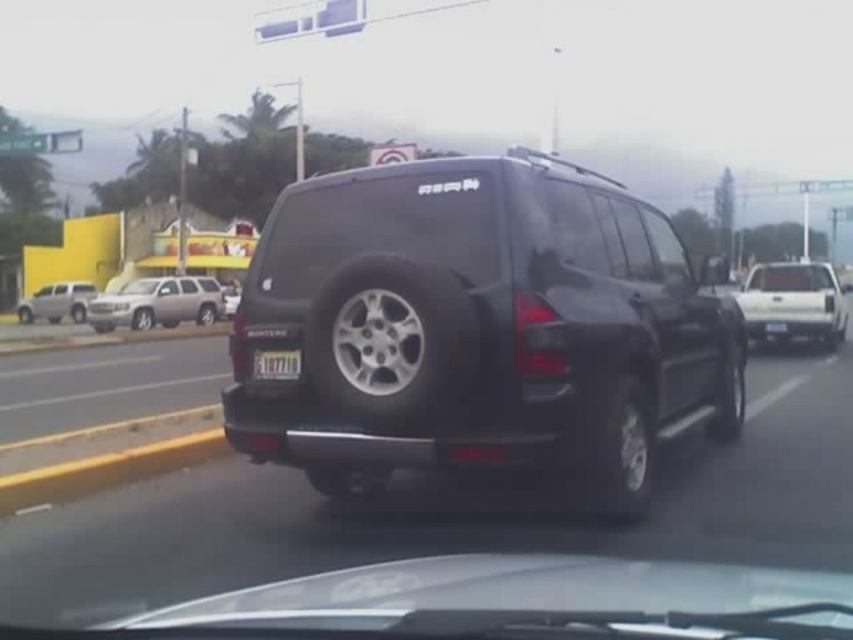
Question: Which point is farther to the camera?

Choices:
 (A) (294, 355)
 (B) (767, 323)
 (C) (50, 294)

Answer: (C)

Question: Does matte black minivan at center have a smaller size compared to white matte truck at right?

Choices:
 (A) yes
 (B) no

Answer: (A)

Question: Can you confirm if matte black minivan at center is thinner than satin silver suv at left?

Choices:
 (A) no
 (B) yes

Answer: (A)

Question: Among these points, which one is nearest to the camera?

Choices:
 (A) (778, 323)
 (B) (831, 349)

Answer: (A)

Question: Which of the following is the farthest from the observer?

Choices:
 (A) transparent glass windshield at center
 (B) white plastic license plate at center
 (C) white matte truck at right

Answer: (C)

Question: In this image, where is white matte truck at right located relative to white plastic license plate at center?

Choices:
 (A) above
 (B) below

Answer: (A)